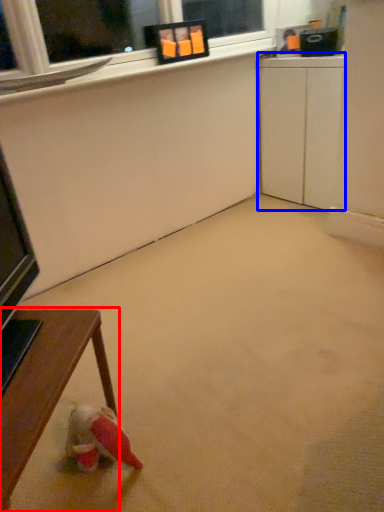
Question: Which object is further to the camera taking this photo, table (highlighted by a red box) or computer desk (highlighted by a blue box)?

Choices:
 (A) table
 (B) computer desk

Answer: (B)